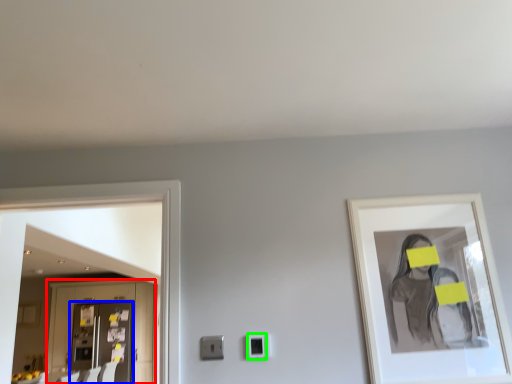
Question: Estimate the real-world distances between objects in this image. Which object is closer to cabinetry (highlighted by a red box), door (highlighted by a blue box) or electric outlet (highlighted by a green box)?

Choices:
 (A) door
 (B) electric outlet

Answer: (A)